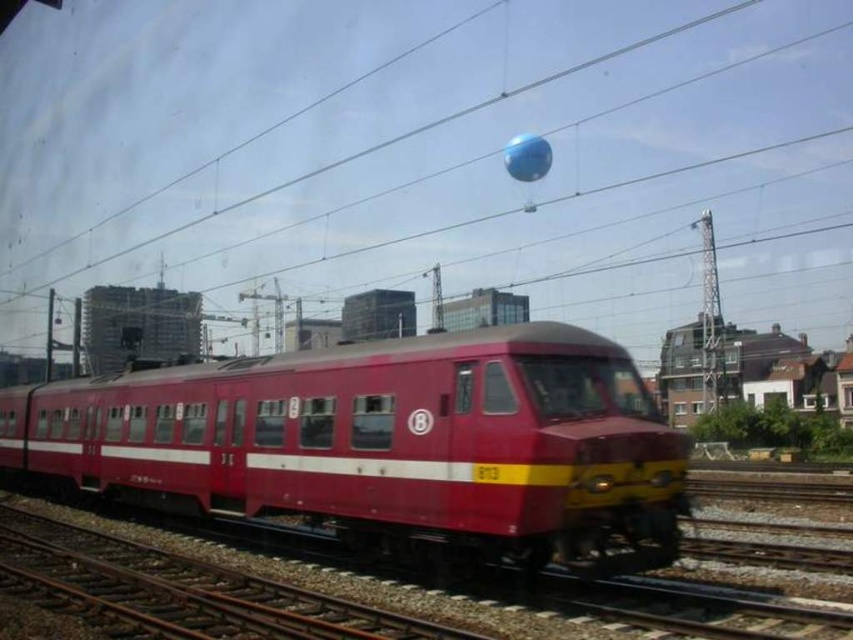
You are a bird flying over the railway tracks. You see the matte red train at center and the blue rubber balloon at upper center. Which object is closer to the left side of your view?

The matte red train at center is to the left of blue rubber balloon at upper center, so it is closer to the left side of your view.

You are a maintenance worker standing at the point marked at coordinates point [386,442]. You need to inspect the nearest train. Which train should you inspect?

The point [386,442] corresponds to the matte red train at center, so you should inspect the matte red train at center.

In the scene shown: You are a photographer standing on the platform waiting to take a picture of the matte red train at center and the blue rubber balloon at upper center. You want to ensure both are fully visible in your shot. Given that your camera has a fixed focal length, which object should you position closer to the edge of the frame to avoid cropping?

The blue rubber balloon at upper center is taller than the matte red train at center. To ensure both are fully visible, position the blue rubber balloon at upper center closer to the edge of the frame since it is taller and requires more space vertically.